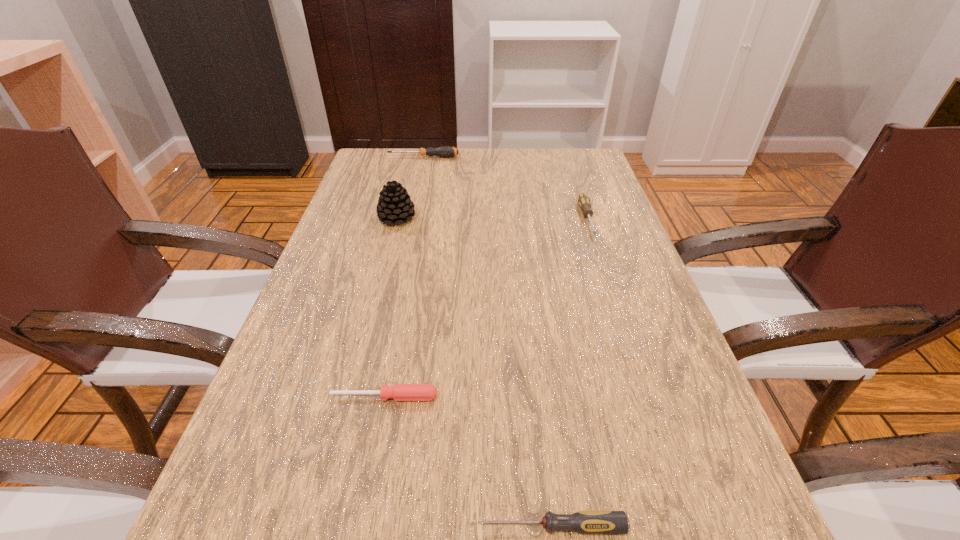
Image resolution: width=960 pixels, height=540 pixels. What are the coordinates of `free space at the right edge of the desktop` in the screenshot? It's located at pyautogui.click(x=621, y=446).

The image size is (960, 540). I want to click on free location at the far left corner of the desktop, so click(369, 163).

In the image, there is a desktop. Where is `vacant space at the far right corner`? The height and width of the screenshot is (540, 960). vacant space at the far right corner is located at coordinates (590, 168).

Identify the location of free space between the rightmost screwdriver and the third farthest screwdriver. This screenshot has height=540, width=960. (486, 308).

At what (x,y) coordinates should I click in order to perform the action: click on unoccupied area between the third farthest screwdriver and the fourth object from left to right. Please return your answer as a coordinate pair (x, y). This screenshot has width=960, height=540. Looking at the image, I should click on (468, 462).

Locate an element on the screen. Image resolution: width=960 pixels, height=540 pixels. vacant point located between the farthest object and the nearest screwdriver is located at coordinates (487, 342).

I want to click on vacant space in between the third nearest screwdriver and the farthest object, so click(505, 188).

What are the coordinates of `empty location between the tallest object and the third farthest screwdriver` in the screenshot? It's located at (391, 307).

Locate an element on the screen. free spot between the second farthest screwdriver and the second nearest screwdriver is located at coordinates (486, 308).

Locate an element on the screen. This screenshot has width=960, height=540. vacant space in between the second screwdriver from right to left and the rightmost object is located at coordinates (569, 373).